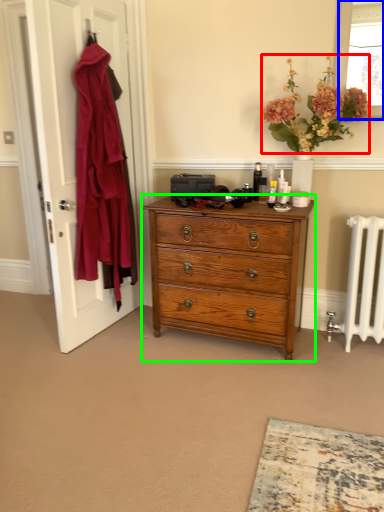
Question: Which object is positioned closest to flower (highlighted by a red box)? Select from window screen (highlighted by a blue box) and chest of drawers (highlighted by a green box).

Choices:
 (A) window screen
 (B) chest of drawers

Answer: (A)